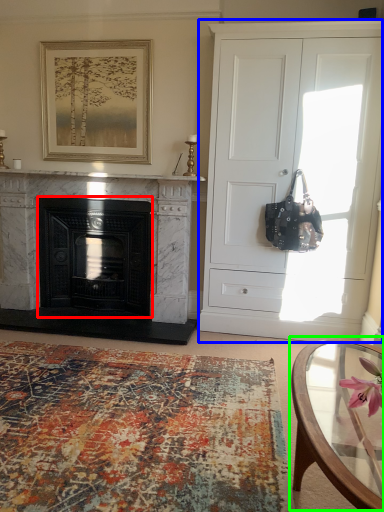
Question: Which is farther away from fireplace (highlighted by a red box)? cabinetry (highlighted by a blue box) or coffee table (highlighted by a green box)?

Choices:
 (A) cabinetry
 (B) coffee table

Answer: (B)